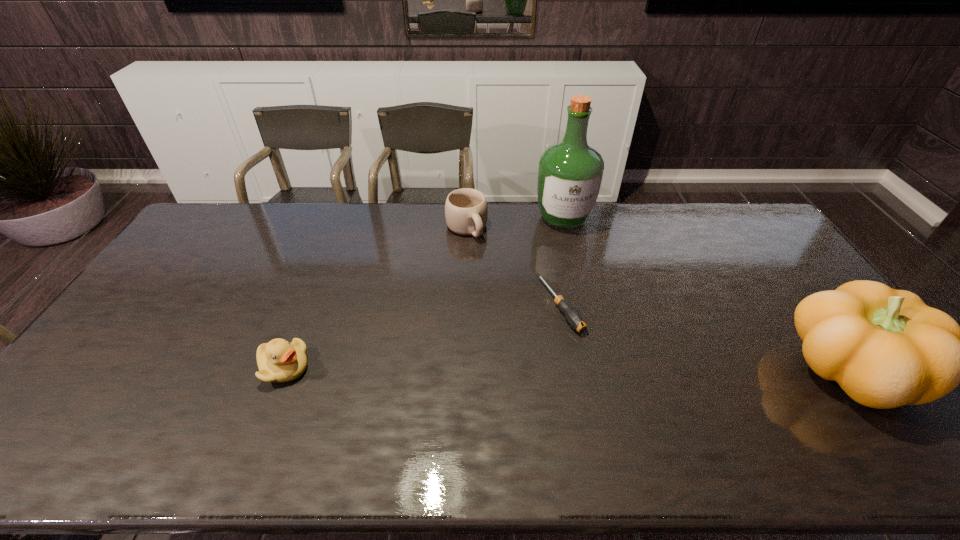
Locate an element on the screen. The height and width of the screenshot is (540, 960). free space on the desktop that is between the duckling and the second tallest object and is positioned at the tip of the screwdriver is located at coordinates (612, 369).

Identify the location of vacant space on the desktop that is between the duckling and the pumpkin and is positioned on the side of the second object from left to right with the handle. The width and height of the screenshot is (960, 540). (572, 369).

Identify the location of free space on the desktop that is between the duckling and the rightmost object and is positioned on the front-facing side of the tallest object. (603, 369).